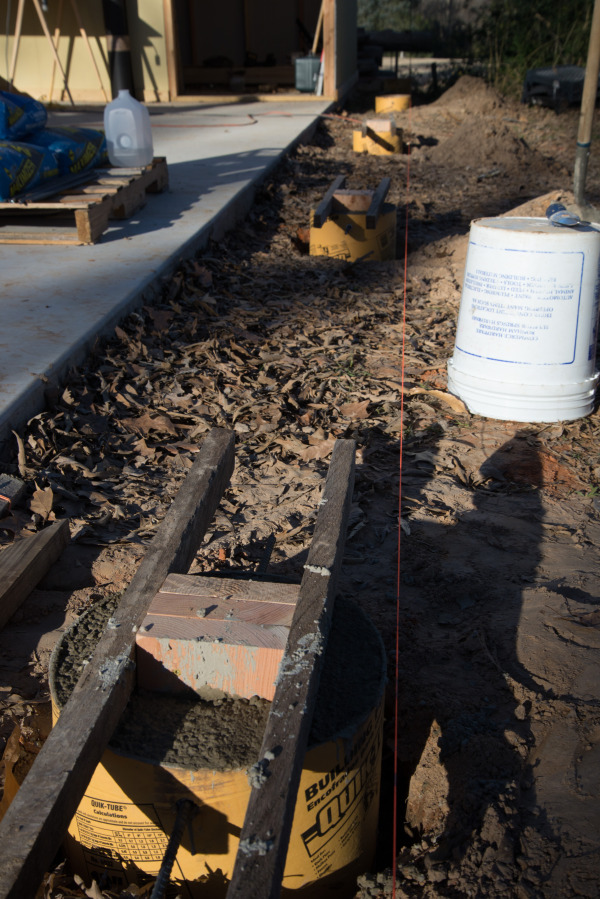
Locate an element on the screen. This screenshot has height=899, width=600. bucket is located at coordinates (504, 353).